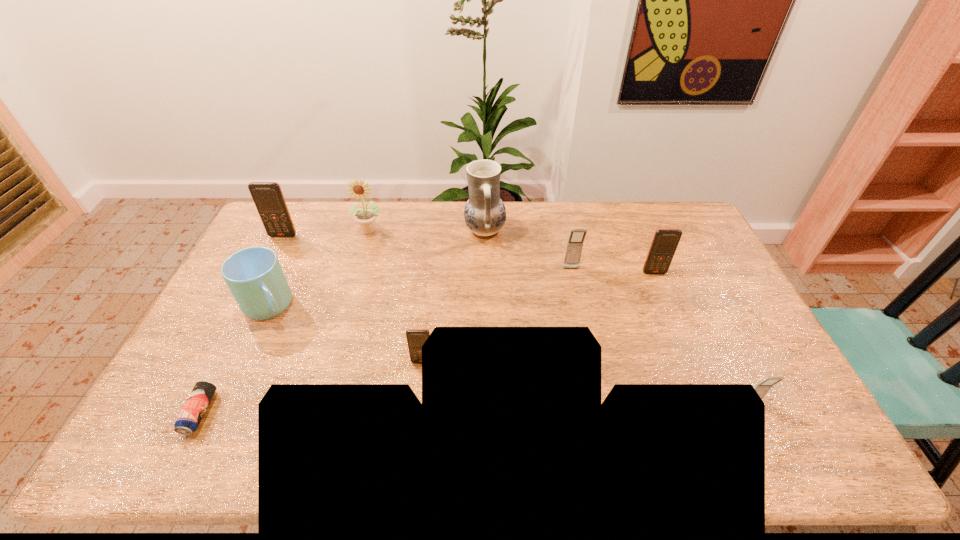
This screenshot has height=540, width=960. Identify the location of vacant space situated on the front-facing side of the seventh object from left to right. (590, 355).

At what (x,y) coordinates should I click in order to perform the action: click on free space located on the screen of the second farthest orange cellular telephone. Please return your answer as a coordinate pair (x, y). Looking at the image, I should click on (697, 375).

You are a GUI agent. You are given a task and a screenshot of the screen. Output one action in this format:
    pyautogui.click(x=<x>, y=<y>)
    Task: Click on the vacant space located 0.350m on the right of the fourth nearest object
    This screenshot has height=540, width=960.
    Given the screenshot: What is the action you would take?
    pyautogui.click(x=409, y=306)

Locate an element on the screen. This screenshot has width=960, height=540. free space located on the screen of the nearest orange cellular telephone is located at coordinates (417, 410).

Image resolution: width=960 pixels, height=540 pixels. Identify the location of free spot located on the front-facing side of the nearest cellular telephone. (780, 463).

At what (x,y) coordinates should I click in order to perform the action: click on vacant space located 0.090m on the right of the beer can. Please return your answer as a coordinate pair (x, y). Looking at the image, I should click on (246, 413).

Find the location of a particular element. The width and height of the screenshot is (960, 540). pottery at the far edge is located at coordinates (484, 213).

Identify the location of sunflower that is at the far edge. This screenshot has width=960, height=540. (366, 218).

Find the location of a particular element. cellular telephone at the far edge is located at coordinates (268, 197).

Image resolution: width=960 pixels, height=540 pixels. I want to click on object positioned at the near edge, so click(198, 401).